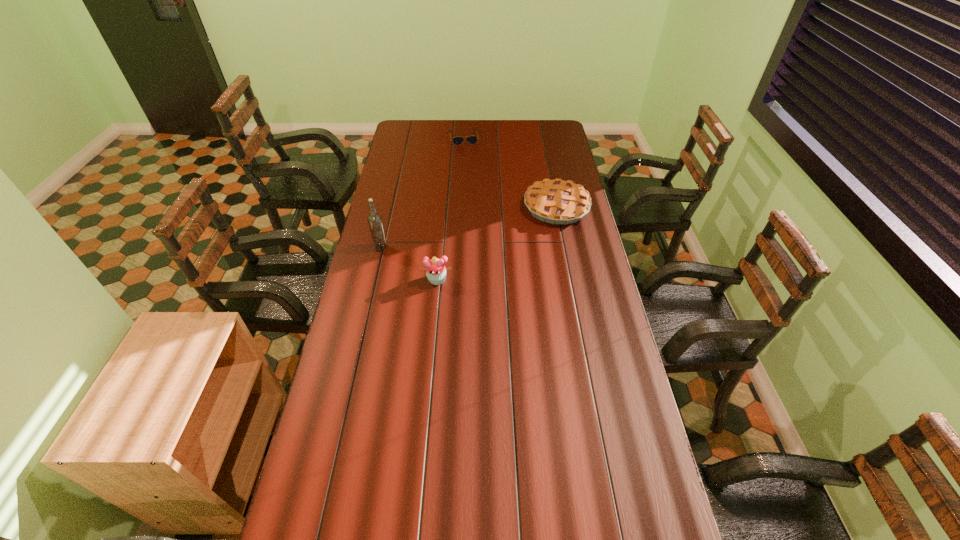
Locate an element on the screen. This screenshot has height=540, width=960. vacant area that lies between the pie and the nearest object is located at coordinates (496, 244).

Identify the location of unoccupied area between the nearest object and the pie. The width and height of the screenshot is (960, 540). (496, 244).

Identify the location of object that stands as the closest to the farthest object. (556, 201).

I want to click on object that is the third closest one to the vodka, so click(x=472, y=140).

Where is `free location that satisfies the following two spatial constraints: 1. on the back side of the rightmost object; 2. on the right side of the tallest object`? This screenshot has width=960, height=540. free location that satisfies the following two spatial constraints: 1. on the back side of the rightmost object; 2. on the right side of the tallest object is located at coordinates (390, 207).